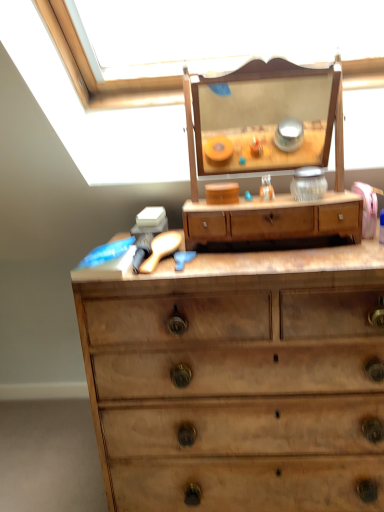
Describe the element at coordinates (240, 381) in the screenshot. I see `wooden chest of drawers at center` at that location.

This screenshot has height=512, width=384. I want to click on wooden chest of drawers at center, so click(x=240, y=381).

In order to face wooden chest of drawers at center, should I rotate leftwards or rightwards?

To align with it, rotate right about 9.602°.

Identify the location of wooden drawer at center. (273, 221).

Describe the element at coordinates (273, 221) in the screenshot. The width and height of the screenshot is (384, 512). I see `wooden drawer at center` at that location.

You are a GUI agent. You are given a task and a screenshot of the screen. Output one action in this format:
    pyautogui.click(x=<x>, y=<y>)
    Task: Click on the wooden chest of drawers at center
    The width and height of the screenshot is (384, 512).
    Given the screenshot: What is the action you would take?
    pyautogui.click(x=240, y=381)

Which is more to the right, wooden drawer at center or wooden chest of drawers at center?

wooden chest of drawers at center.

Is the depth of wooden drawer at center greater than that of wooden chest of drawers at center?

Yes, wooden drawer at center is behind wooden chest of drawers at center.

Is point (187, 214) positioned behind point (319, 448)?

Yes, it is behind point (319, 448).

From the image's perspective, is wooden drawer at center above or below wooden chest of drawers at center?

wooden drawer at center is situated higher than wooden chest of drawers at center in the image.

From a real-world perspective, who is located lower, wooden drawer at center or wooden chest of drawers at center?

wooden chest of drawers at center, from a real-world perspective.

Between wooden drawer at center and wooden chest of drawers at center, which one has smaller width?

Thinner between the two is wooden drawer at center.

Is wooden drawer at center taller than wooden chest of drawers at center?

No.

Between wooden drawer at center and wooden chest of drawers at center, which one has larger size?

With larger size is wooden chest of drawers at center.

Can we say wooden drawer at center lies outside wooden chest of drawers at center?

wooden drawer at center lies outside wooden chest of drawers at center's area.

Consider the image. Is wooden drawer at center with wooden chest of drawers at center?

No, wooden drawer at center is not with wooden chest of drawers at center.

Is wooden drawer at center oriented towards wooden chest of drawers at center?

No.

Measure the distance between wooden drawer at center and wooden chest of drawers at center.

They are 11.63 inches apart.

Find the location of a particular element. Image resolution: width=384 pixels, height=512 pixels. drawer on the left of wooden chest of drawers at center is located at coordinates (273, 221).

Is wooden chest of drawers at center at the right side of wooden drawer at center?

Correct, you'll find wooden chest of drawers at center to the right of wooden drawer at center.

Which is in front, wooden chest of drawers at center or wooden drawer at center?

wooden chest of drawers at center is closer to the camera.

Is point (128, 375) positioned behind point (290, 224)?

That is False.

From the picture: From the image's perspective, which object appears higher, wooden chest of drawers at center or wooden drawer at center?

wooden drawer at center, from the image's perspective.

From a real-world perspective, is wooden chest of drawers at center beneath wooden drawer at center?

Yes, from a real-world perspective, wooden chest of drawers at center is under wooden drawer at center.

Considering the sizes of wooden chest of drawers at center and wooden drawer at center in the image, is wooden chest of drawers at center wider or thinner than wooden drawer at center?

Considering their sizes, wooden chest of drawers at center looks broader than wooden drawer at center.

Does wooden chest of drawers at center have a greater height compared to wooden drawer at center?

Correct, wooden chest of drawers at center is much taller as wooden drawer at center.

Is wooden chest of drawers at center bigger or smaller than wooden drawer at center?

In the image, wooden chest of drawers at center appears to be larger than wooden drawer at center.

Would you say wooden chest of drawers at center contains wooden drawer at center?

No, wooden chest of drawers at center does not contain wooden drawer at center.

Are wooden chest of drawers at center and wooden drawer at center making contact?

wooden chest of drawers at center and wooden drawer at center are clearly separated.

Is wooden chest of drawers at center facing towards wooden drawer at center?

No, wooden chest of drawers at center is not turned towards wooden drawer at center.

How distant is wooden chest of drawers at center from wooden drawer at center?

wooden chest of drawers at center and wooden drawer at center are 11.63 inches apart from each other.

What are the coordinates of `chest of drawers below the wooden drawer at center (from a real-world perspective)` in the screenshot? It's located at (240, 381).

You are a GUI agent. You are given a task and a screenshot of the screen. Output one action in this format:
    pyautogui.click(x=<x>, y=<y>)
    Task: Click on the drawer above the wooden chest of drawers at center (from the image's perspective)
    This screenshot has width=384, height=512.
    Given the screenshot: What is the action you would take?
    pyautogui.click(x=273, y=221)

Locate an element on the screen. The image size is (384, 512). drawer located on the left of wooden chest of drawers at center is located at coordinates (273, 221).